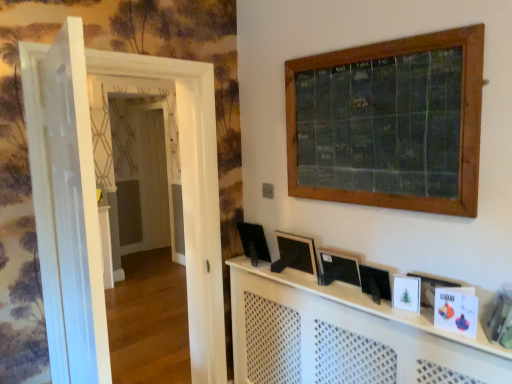
Question: Can you confirm if black plastic computer screen at center is positioned to the right of white glossy door at left, which is counted as the 1th door, starting from the back?

Choices:
 (A) no
 (B) yes

Answer: (B)

Question: From a real-world perspective, is black plastic computer screen at center on white glossy door at left, which is counted as the 1th door, starting from the back?

Choices:
 (A) yes
 (B) no

Answer: (A)

Question: Is black plastic computer screen at center closer to camera compared to white glossy door at left, positioned as the 2th door in front-to-back order?

Choices:
 (A) yes
 (B) no

Answer: (B)

Question: Is black plastic computer screen at center looking in the opposite direction of white glossy door at left, which is counted as the 1th door, starting from the back?

Choices:
 (A) no
 (B) yes

Answer: (A)

Question: Does black plastic computer screen at center contain white glossy door at left, which is counted as the 1th door, starting from the back?

Choices:
 (A) yes
 (B) no

Answer: (B)

Question: Is black plastic computer screen at center taller than white glossy door at left, which is counted as the 1th door, starting from the back?

Choices:
 (A) yes
 (B) no

Answer: (B)

Question: Considering the relative sizes of black matte picture frame at center, marked as the 3th picture frame in a right-to-left arrangement, and white glossy door at left, the second door when ordered from back to front, in the image provided, is black matte picture frame at center, marked as the 3th picture frame in a right-to-left arrangement, shorter than white glossy door at left, the second door when ordered from back to front,?

Choices:
 (A) yes
 (B) no

Answer: (A)

Question: Could you tell me if black matte picture frame at center, which is counted as the 1th picture frame, starting from the left, is turned towards white glossy door at left, placed as the first door when sorted from front to back?

Choices:
 (A) no
 (B) yes

Answer: (B)

Question: Is black matte picture frame at center, marked as the third picture frame in a front-to-back arrangement, next to white glossy door at left, placed as the first door when sorted from front to back, and touching it?

Choices:
 (A) yes
 (B) no

Answer: (B)

Question: From a real-world perspective, does black matte picture frame at center, marked as the third picture frame in a front-to-back arrangement, sit lower than white glossy door at left, the second door when ordered from back to front?

Choices:
 (A) yes
 (B) no

Answer: (A)

Question: From a real-world perspective, is black matte picture frame at center, marked as the third picture frame in a front-to-back arrangement, on top of white glossy door at left, placed as the first door when sorted from front to back?

Choices:
 (A) no
 (B) yes

Answer: (A)

Question: Considering the relative sizes of black matte picture frame at center, acting as the first picture frame starting from the back, and white glossy door at left, the second door when ordered from back to front, in the image provided, is black matte picture frame at center, acting as the first picture frame starting from the back, thinner than white glossy door at left, the second door when ordered from back to front,?

Choices:
 (A) no
 (B) yes

Answer: (B)

Question: Does black matte picture frame at center, which is counted as the 1th picture frame, starting from the left, have a lesser height compared to black plastic computer screen at center?

Choices:
 (A) yes
 (B) no

Answer: (A)